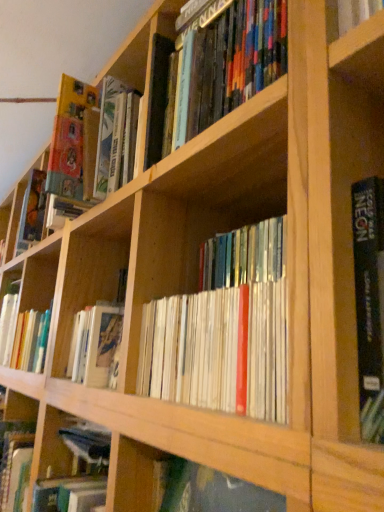
This screenshot has height=512, width=384. Describe the element at coordinates (132, 474) in the screenshot. I see `wooden bookshelf at center` at that location.

The image size is (384, 512). What are the coordinates of `wooden bookshelf at center` in the screenshot? It's located at (132, 474).

What do you see at coordinates (91, 305) in the screenshot? I see `wooden bookshelf at center` at bounding box center [91, 305].

The width and height of the screenshot is (384, 512). I want to click on wooden bookshelf at center, so click(x=91, y=305).

What is the approximate height of wooden bookshelf at center?

13.67 inches.

The width and height of the screenshot is (384, 512). What are the coordinates of `wooden bookshelf at center` in the screenshot? It's located at (132, 474).

Is wooden bookshelf at center to the right of wooden bookshelf at center from the viewer's perspective?

Incorrect, wooden bookshelf at center is not on the right side of wooden bookshelf at center.

Relative to wooden bookshelf at center, is wooden bookshelf at center in front or behind?

wooden bookshelf at center is positioned farther from the viewer than wooden bookshelf at center.

Which is in front, point (90, 312) or point (297, 502)?

Point (297, 502)

From the image's perspective, is wooden bookshelf at center above wooden bookshelf at center?

Correct, wooden bookshelf at center appears higher than wooden bookshelf at center in the image.

From a real-world perspective, does wooden bookshelf at center stand above wooden bookshelf at center?

Correct, in the physical world, wooden bookshelf at center is higher than wooden bookshelf at center.

Can you confirm if wooden bookshelf at center is wider than wooden bookshelf at center?

No.

In terms of height, does wooden bookshelf at center look taller or shorter compared to wooden bookshelf at center?

wooden bookshelf at center is taller than wooden bookshelf at center.

Based on their sizes in the image, would you say wooden bookshelf at center is bigger or smaller than wooden bookshelf at center?

wooden bookshelf at center is bigger than wooden bookshelf at center.

Is wooden bookshelf at center not within wooden bookshelf at center?

That's correct, wooden bookshelf at center is outside of wooden bookshelf at center.

Based on the photo, is wooden bookshelf at center not near wooden bookshelf at center?

No, there isn't a large distance between wooden bookshelf at center and wooden bookshelf at center.

Is wooden bookshelf at center turned away from wooden bookshelf at center?

That's not correct — wooden bookshelf at center is not looking away from wooden bookshelf at center.

Can you tell me how much wooden bookshelf at center and wooden bookshelf at center differ in facing direction?

0.000719 degrees separate the facing orientations of wooden bookshelf at center and wooden bookshelf at center.

The width and height of the screenshot is (384, 512). Find the location of `cabinet above the wooden bookshelf at center (from a real-world perspective)`. cabinet above the wooden bookshelf at center (from a real-world perspective) is located at coordinates (91, 305).

In the image, is wooden bookshelf at center on the left side or the right side of wooden bookshelf at center?

wooden bookshelf at center is to the right of wooden bookshelf at center.

Considering the positions of objects wooden bookshelf at center and wooden bookshelf at center in the image provided, who is in front, wooden bookshelf at center or wooden bookshelf at center?

wooden bookshelf at center is in front.

Is point (153, 474) in front of point (74, 378)?

Yes, point (153, 474) is closer to viewer.

Consider the image. From the image's perspective, would you say wooden bookshelf at center is positioned over wooden bookshelf at center?

Actually, wooden bookshelf at center appears below wooden bookshelf at center in the image.

From a real-world perspective, is wooden bookshelf at center on top of wooden bookshelf at center?

No.

Which object is wider, wooden bookshelf at center or wooden bookshelf at center?

wooden bookshelf at center.

Is wooden bookshelf at center taller than wooden bookshelf at center?

In fact, wooden bookshelf at center may be shorter than wooden bookshelf at center.

Who is smaller, wooden bookshelf at center or wooden bookshelf at center?

With smaller size is wooden bookshelf at center.

Looking at this image, would you say wooden bookshelf at center contains wooden bookshelf at center?

No, wooden bookshelf at center is not a part of wooden bookshelf at center.

Are wooden bookshelf at center and wooden bookshelf at center far apart?

No.

Does wooden bookshelf at center turn towards wooden bookshelf at center?

No, wooden bookshelf at center does not turn towards wooden bookshelf at center.

Find the location of a particular element. The height and width of the screenshot is (512, 384). shelf on the right of wooden bookshelf at center is located at coordinates (132, 474).

Where is `cabinet above the wooden bookshelf at center (from the image's perspective)`? The width and height of the screenshot is (384, 512). cabinet above the wooden bookshelf at center (from the image's perspective) is located at coordinates (91, 305).

In order to click on cabinet to the left of wooden bookshelf at center in this screenshot , I will do `click(91, 305)`.